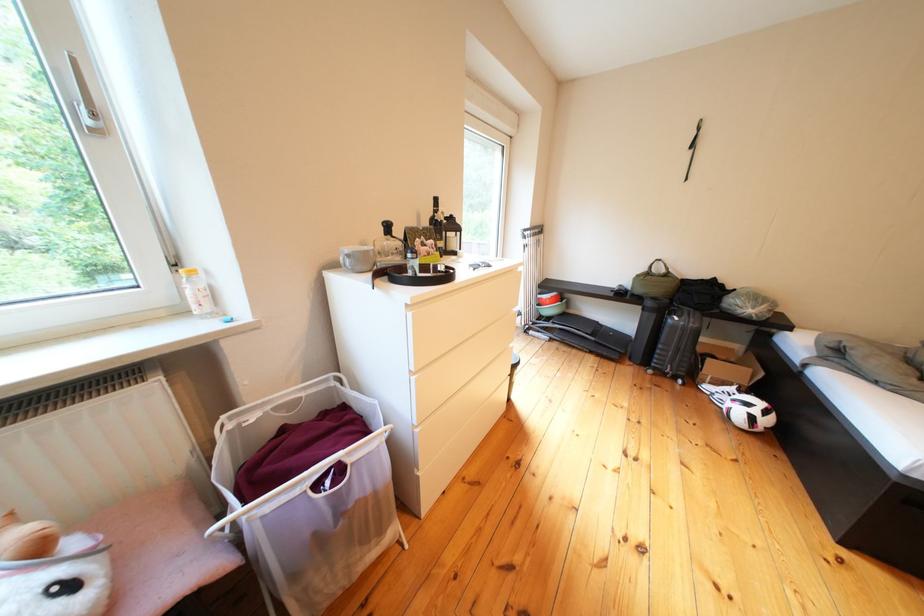
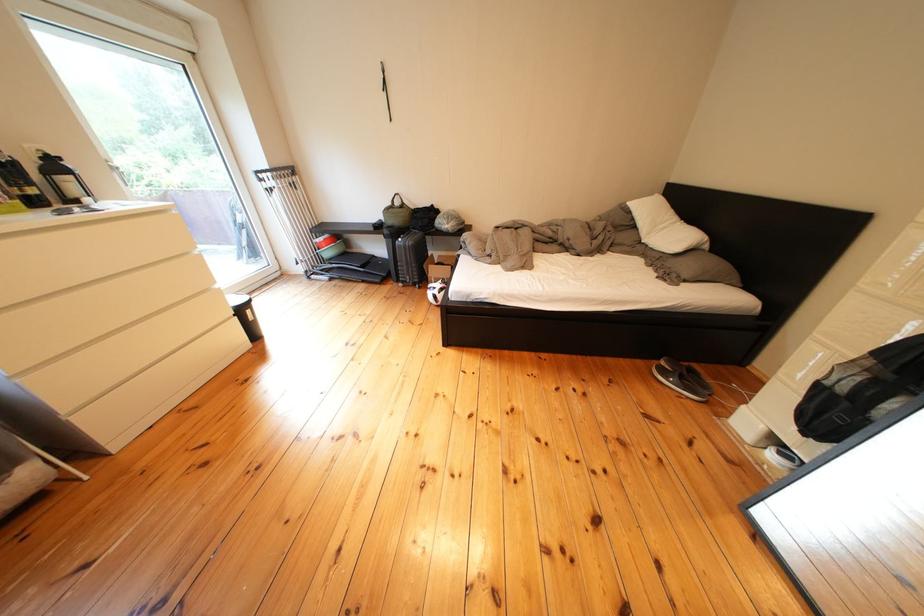
Locate, in the second image, the point that corresponds to the point at 688,382 in the first image.

(429, 290)